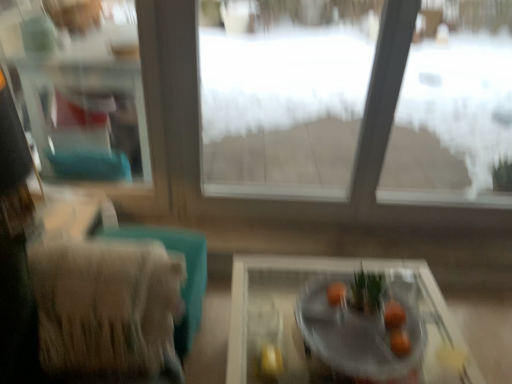
The width and height of the screenshot is (512, 384). Find the location of `vacant point to the left of smooth orange fruit at center`. vacant point to the left of smooth orange fruit at center is located at coordinates (319, 321).